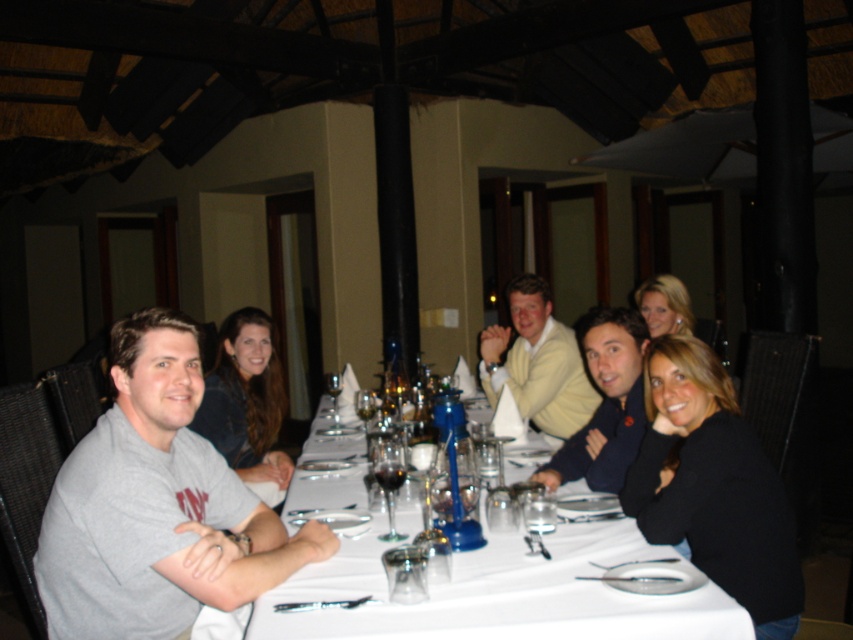
You are a photographer trying to capture a closeup of the light yellow sweater at center without including the dark blue sweater at center in the frame. Based on their positions, is this possible?

The light yellow sweater at center is above the dark blue sweater at center, so it is possible to capture a closeup of the light yellow sweater at center without including the dark blue sweater at center by focusing on the upper part of the scene.

You are standing at the edge of the dining table and want to reach both the point at coordinates point (524, 301) and point (218, 444). Which point should you reach for first if you want to minimize the distance walked?

Point (218, 444) is closer to you than point (524, 301), so you should reach for it first to minimize the distance walked.

You are a photographer trying to capture a group photo of the people at the dining table. You notice the light yellow sweater at center and the dark blue sweater at center. Which sweater should you position closer to the left side of the camera frame to ensure both are visible in the photo?

The light yellow sweater at center is already to the left of the dark blue sweater at center, so positioning the light yellow sweater at center closer to the left side of the camera frame will ensure both sweaters remain visible in the photo.